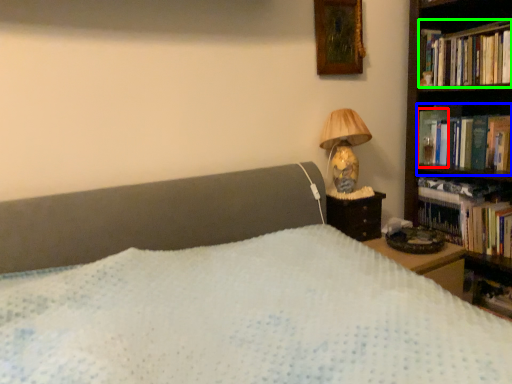
Question: Based on their relative distances, which object is nearer to paperback book (highlighted by a red box)? Choose from book (highlighted by a blue box) and book (highlighted by a green box).

Choices:
 (A) book
 (B) book

Answer: (A)